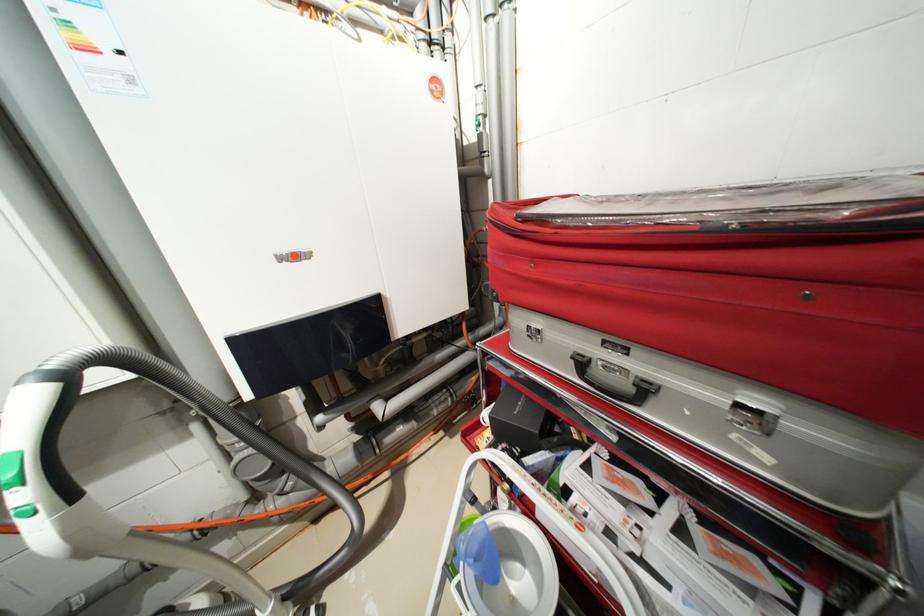
Where is `blue plastic handle`? The width and height of the screenshot is (924, 616). blue plastic handle is located at coordinates (478, 553).